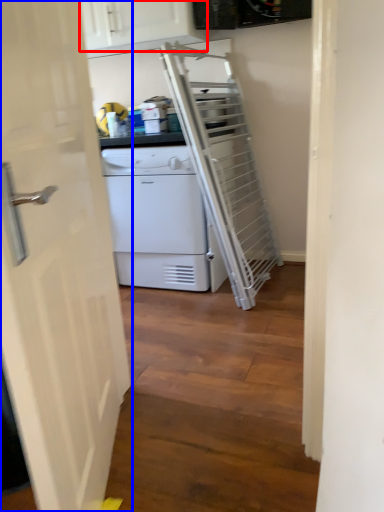
Question: Which point is closer to the camera, cabinetry (highlighted by a red box) or door (highlighted by a blue box)?

Choices:
 (A) cabinetry
 (B) door

Answer: (B)